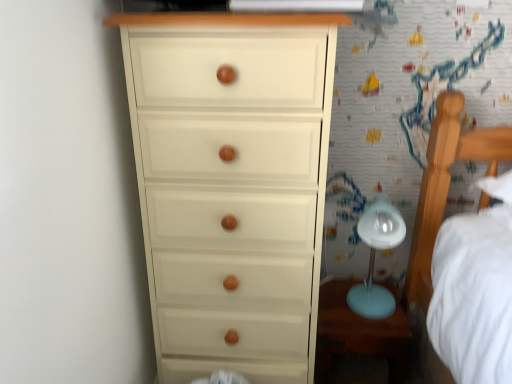
Question: From the image's perspective, is matte white chest of drawers at left located above or below matte blue table at lower right?

Choices:
 (A) below
 (B) above

Answer: (B)

Question: Is matte white chest of drawers at left situated inside matte blue table at lower right or outside?

Choices:
 (A) inside
 (B) outside

Answer: (B)

Question: Estimate the real-world distances between objects in this image. Which object is closer to the matte blue table at lower right?

Choices:
 (A) matte white chest of drawers at left
 (B) light blue plastic table lamp at right

Answer: (B)

Question: Which object is the farthest from the matte white chest of drawers at left?

Choices:
 (A) matte blue table at lower right
 (B) light blue plastic table lamp at right

Answer: (B)